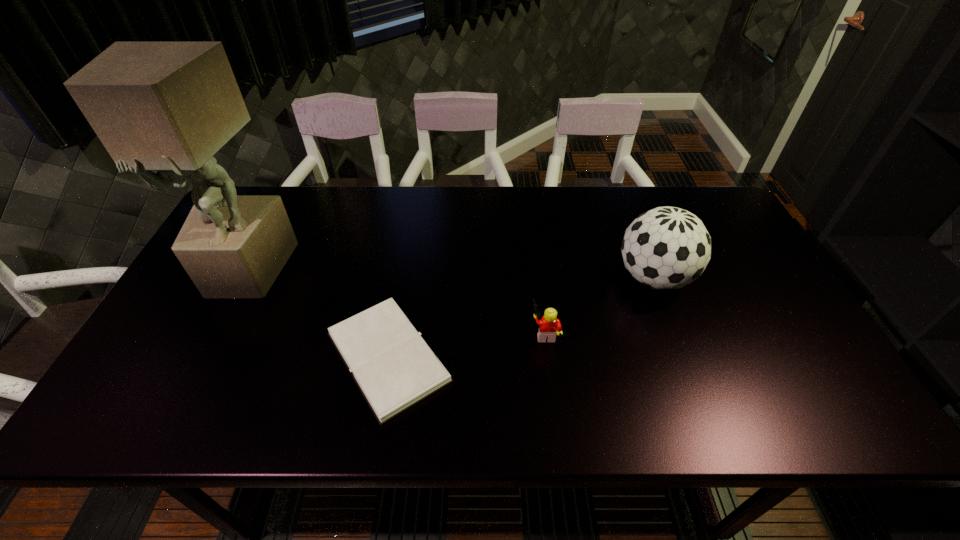
The image size is (960, 540). Identify the location of the tallest object. (168, 107).

You are a GUI agent. You are given a task and a screenshot of the screen. Output one action in this format:
    pyautogui.click(x=<x>, y=<y>)
    Task: Click on the sculpture
    
    Given the screenshot: What is the action you would take?
    pyautogui.click(x=168, y=107)

Locate an element on the screen. The image size is (960, 540). the rightmost object is located at coordinates pos(665,248).

Where is `soccer ball`? soccer ball is located at coordinates (665, 248).

The width and height of the screenshot is (960, 540). Identify the location of the second object from right to left. (548, 326).

Where is `the second shortest object`? Image resolution: width=960 pixels, height=540 pixels. the second shortest object is located at coordinates (548, 326).

This screenshot has height=540, width=960. I want to click on the shortest object, so click(394, 368).

Where is `the second object from left to right`? This screenshot has height=540, width=960. the second object from left to right is located at coordinates (394, 368).

I want to click on vacant space located 0.350m on the front-facing side of the sculpture, so click(166, 428).

Find the location of a particular element. This screenshot has height=540, width=960. vacant area situated on the left of the rightmost object is located at coordinates (536, 278).